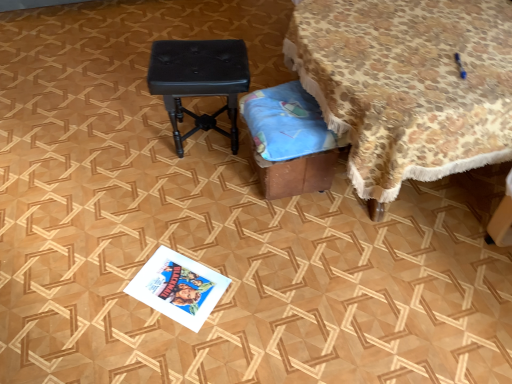
Identify the location of free location to the left of black leather stool at center. (133, 137).